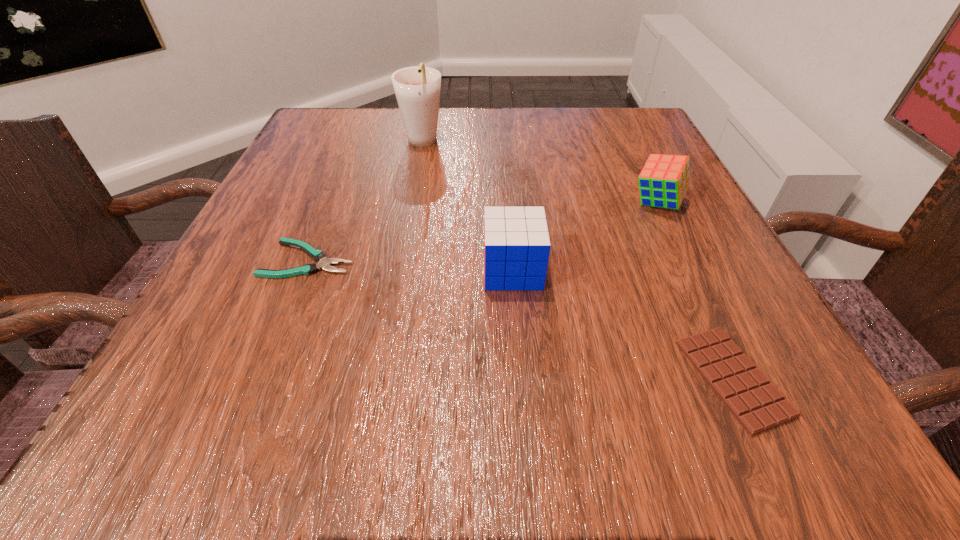
Locate an element on the screen. The image size is (960, 540). vacant space at the left edge is located at coordinates (336, 234).

Locate an element on the screen. vacant space at the right edge is located at coordinates (651, 211).

This screenshot has height=540, width=960. In the image, there is a desktop. In order to click on free region at the far left corner in this screenshot , I will do (x=362, y=107).

The image size is (960, 540). In order to click on free space at the far right corner in this screenshot , I will do `click(605, 143)`.

What are the coordinates of `vacant area that lies between the left cube and the farther cube` in the screenshot? It's located at (585, 237).

At what (x,y) coordinates should I click in order to perform the action: click on blank region between the pliers and the nearer cube. Please return your answer as a coordinate pair (x, y). This screenshot has width=960, height=540. Looking at the image, I should click on (411, 265).

Find the location of a particular element. Image resolution: width=960 pixels, height=540 pixels. free space that is in between the candy bar and the second farthest object is located at coordinates (695, 291).

This screenshot has height=540, width=960. I want to click on free point between the nearer cube and the nearest object, so click(623, 324).

The width and height of the screenshot is (960, 540). Find the location of `unoccupied position between the fourth object from right to left and the pliers`. unoccupied position between the fourth object from right to left and the pliers is located at coordinates (366, 201).

Where is `vacant space that's between the candy bar and the fourth object from right to left`? vacant space that's between the candy bar and the fourth object from right to left is located at coordinates (577, 260).